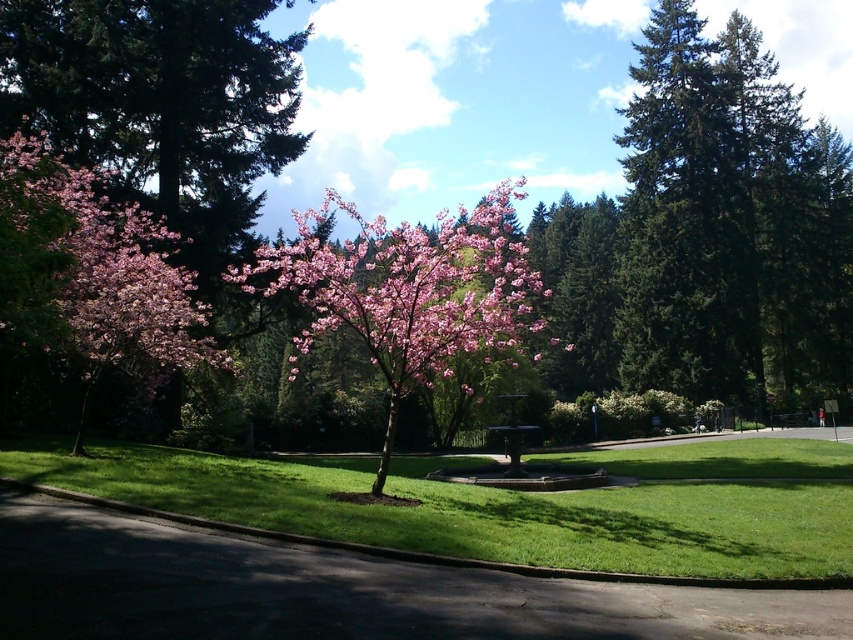
Does green grass at lower center have a lesser width compared to pink matte flower at center?

Yes, green grass at lower center is thinner than pink matte flower at center.

Does green grass at lower center come behind pink matte flower at center?

No, green grass at lower center is closer to the viewer.

Does point (787, 500) lie in front of point (343, 273)?

No, it is behind (343, 273).

Identify the location of green grass at lower center. The height and width of the screenshot is (640, 853). (508, 502).

Locate an element on the screen. This screenshot has width=853, height=640. green grass at lower center is located at coordinates (508, 502).

Looking at this image, who is higher up, green grass at lower center or pink matte flower at left?

Positioned higher is pink matte flower at left.

Does point (505, 552) come closer to viewer compared to point (82, 333)?

Yes, it is in front of point (82, 333).

Where is `green grass at lower center`? The image size is (853, 640). green grass at lower center is located at coordinates (508, 502).

Who is higher up, pink matte flower at center or pink matte flower at left?

Positioned higher is pink matte flower at center.

Is pink matte flower at center taller than pink matte flower at left?

Yes.

Measure the distance between point (460, 342) and camera.

A distance of 39.12 feet exists between point (460, 342) and camera.

Where is `pink matte flower at center`? The width and height of the screenshot is (853, 640). pink matte flower at center is located at coordinates (408, 285).